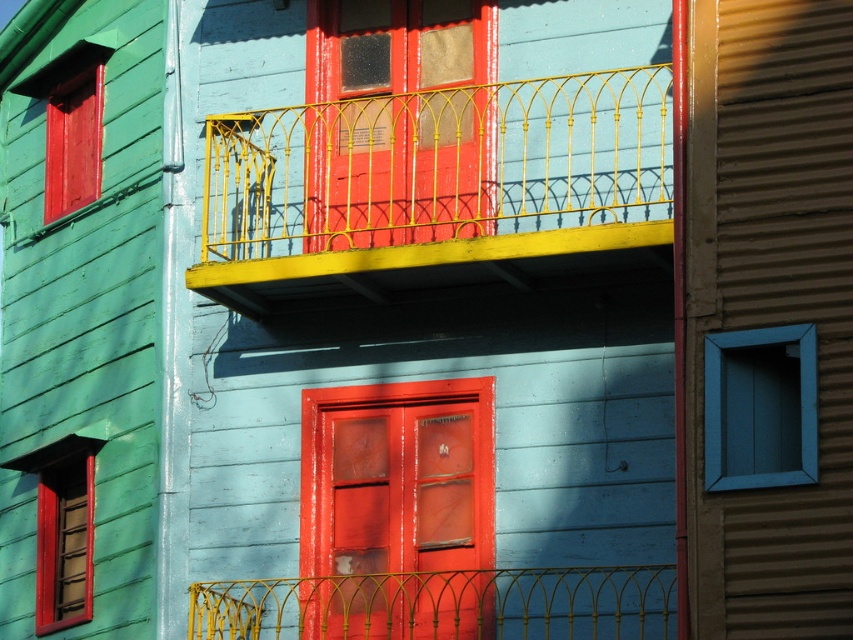
Is point (352, 403) positioned before point (654, 572)?

No, it is not.

Between glossy wood door at center and yellow wire mesh at center, which one is positioned higher?

Positioned higher is glossy wood door at center.

Which is behind, point (358, 454) or point (630, 634)?

Positioned behind is point (358, 454).

You are a GUI agent. You are given a task and a screenshot of the screen. Output one action in this format:
    pyautogui.click(x=<x>, y=<y>)
    Task: Click on the glossy wood door at center
    The image size is (853, 640).
    Given the screenshot: What is the action you would take?
    pyautogui.click(x=397, y=509)

Does blue wood window at right have a smaller size compared to yellow wire mesh at center?

Correct, blue wood window at right occupies less space than yellow wire mesh at center.

Which is below, blue wood window at right or yellow wire mesh at center?

Positioned lower is yellow wire mesh at center.

You are a GUI agent. You are given a task and a screenshot of the screen. Output one action in this format:
    pyautogui.click(x=<x>, y=<y>)
    Task: Click on the blue wood window at right
    The image size is (853, 640).
    Given the screenshot: What is the action you would take?
    pyautogui.click(x=788, y=294)

This screenshot has height=640, width=853. What are the coordinates of `blue wood window at right` in the screenshot? It's located at (788, 294).

Is point (573, 269) positioned in front of point (395, 516)?

Yes, it is.

Who is positioned more to the right, yellow wrought iron balcony at upper center or glossy wood door at center?

yellow wrought iron balcony at upper center

Where is `yellow wrought iron balcony at upper center`? yellow wrought iron balcony at upper center is located at coordinates (436, 189).

Identify the location of yellow wrought iron balcony at upper center. (436, 189).